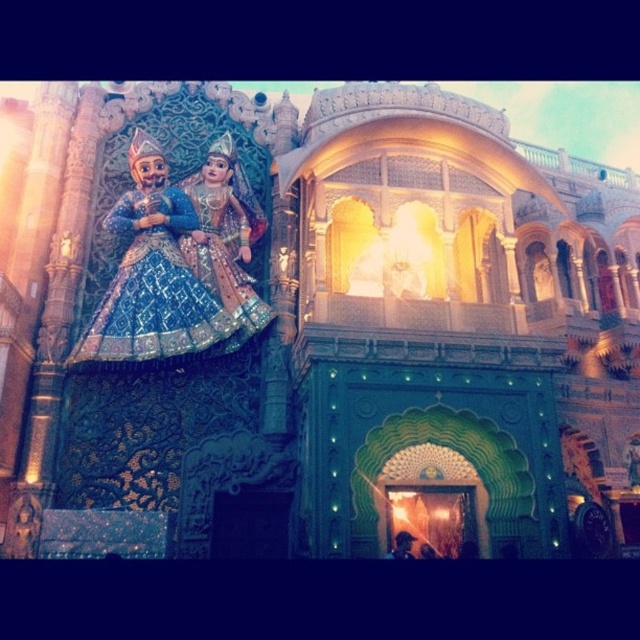
Question: Is green carved wood palace at upper center thinner than shiny blue fabric dress at upper left?

Choices:
 (A) no
 (B) yes

Answer: (A)

Question: Is green carved wood palace at upper center wider than shiny blue fabric dress at upper left?

Choices:
 (A) no
 (B) yes

Answer: (B)

Question: Which object is closer to the camera taking this photo?

Choices:
 (A) shiny blue fabric dress at upper left
 (B) green carved wood palace at upper center

Answer: (B)

Question: Among these points, which one is nearest to the camera?

Choices:
 (A) (461, 282)
 (B) (134, 268)

Answer: (B)

Question: Does green carved wood palace at upper center lie in front of shiny blue fabric dress at upper left?

Choices:
 (A) yes
 (B) no

Answer: (A)